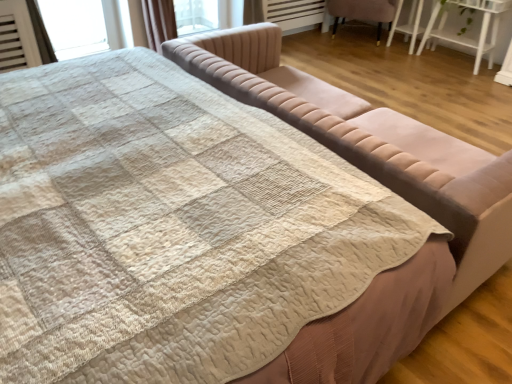
Question: Considering the relative sizes of velvet beige studio couch at center and white glossy table at upper right in the image provided, is velvet beige studio couch at center bigger than white glossy table at upper right?

Choices:
 (A) yes
 (B) no

Answer: (A)

Question: Would you say velvet beige studio couch at center contains white glossy table at upper right?

Choices:
 (A) yes
 (B) no

Answer: (B)

Question: Is velvet beige studio couch at center closer to the viewer compared to white glossy table at upper right?

Choices:
 (A) yes
 (B) no

Answer: (A)

Question: From the image's perspective, does velvet beige studio couch at center appear lower than white glossy table at upper right?

Choices:
 (A) yes
 (B) no

Answer: (A)

Question: Is velvet beige studio couch at center behind white glossy table at upper right?

Choices:
 (A) no
 (B) yes

Answer: (A)

Question: Relative to velvet beige studio couch at center, is velvet pink chair at upper right in front or behind?

Choices:
 (A) front
 (B) behind

Answer: (B)

Question: In terms of height, does velvet pink chair at upper right look taller or shorter compared to velvet beige studio couch at center?

Choices:
 (A) short
 (B) tall

Answer: (A)

Question: In terms of size, does velvet pink chair at upper right appear bigger or smaller than velvet beige studio couch at center?

Choices:
 (A) small
 (B) big

Answer: (A)

Question: Considering the positions of point (342, 13) and point (170, 49), is point (342, 13) closer or farther from the camera than point (170, 49)?

Choices:
 (A) closer
 (B) farther

Answer: (B)

Question: In the image, is velvet pink chair at upper right positioned in front of or behind white glossy table at upper right?

Choices:
 (A) behind
 (B) front

Answer: (A)

Question: Is velvet pink chair at upper right taller or shorter than white glossy table at upper right?

Choices:
 (A) tall
 (B) short

Answer: (B)

Question: From the image's perspective, relative to white glossy table at upper right, is velvet pink chair at upper right above or below?

Choices:
 (A) above
 (B) below

Answer: (A)

Question: Looking at the image, does velvet pink chair at upper right seem bigger or smaller compared to white glossy table at upper right?

Choices:
 (A) big
 (B) small

Answer: (A)

Question: In terms of width, does velvet beige studio couch at center look wider or thinner when compared to velvet pink chair at upper right?

Choices:
 (A) thin
 (B) wide

Answer: (B)

Question: Based on their sizes in the image, would you say velvet beige studio couch at center is bigger or smaller than velvet pink chair at upper right?

Choices:
 (A) big
 (B) small

Answer: (A)